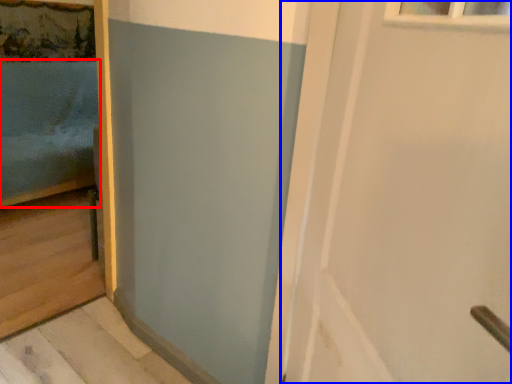
Question: Which of the following is the farthest to the observer, bed (highlighted by a red box) or door (highlighted by a blue box)?

Choices:
 (A) bed
 (B) door

Answer: (A)